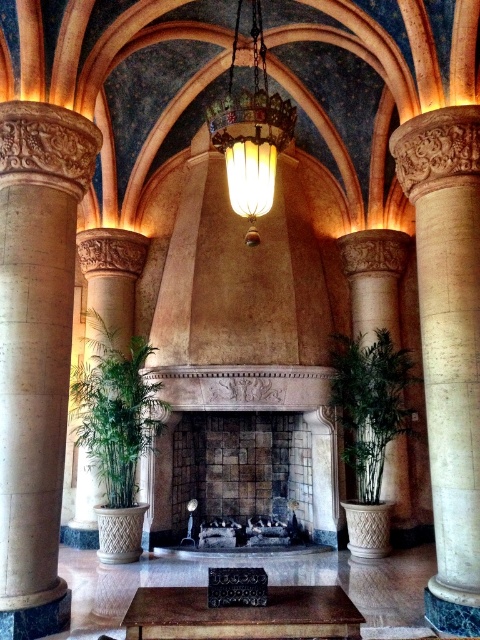
Is point (92, 396) behind point (372, 499)?

No.

Can you confirm if green leafy plant at left is positioned below green leafy plant at center?

No.

Is point (81, 435) farther from camera compared to point (332, 336)?

No, (81, 435) is in front of (332, 336).

I want to click on green leafy plant at left, so click(x=115, y=410).

How much distance is there between stone fireplace at center and green leafy plant at right?

stone fireplace at center is 5.95 feet away from green leafy plant at right.

Between stone fireplace at center and green leafy plant at right, which one has more height?

stone fireplace at center is taller.

Is point (192, 387) positioned behind point (384, 308)?

No, it is not.

Image resolution: width=480 pixels, height=640 pixels. I want to click on stone fireplace at center, so pyautogui.click(x=269, y=410).

Is beige stone column at left positioned at the back of stone fireplace at center?

No, it is not.

Where is `beige stone column at left`? beige stone column at left is located at coordinates tap(36, 349).

Which is behind, point (68, 396) or point (322, 461)?

The point (322, 461) is more distant.

This screenshot has height=640, width=480. I want to click on beige stone column at left, so click(36, 349).